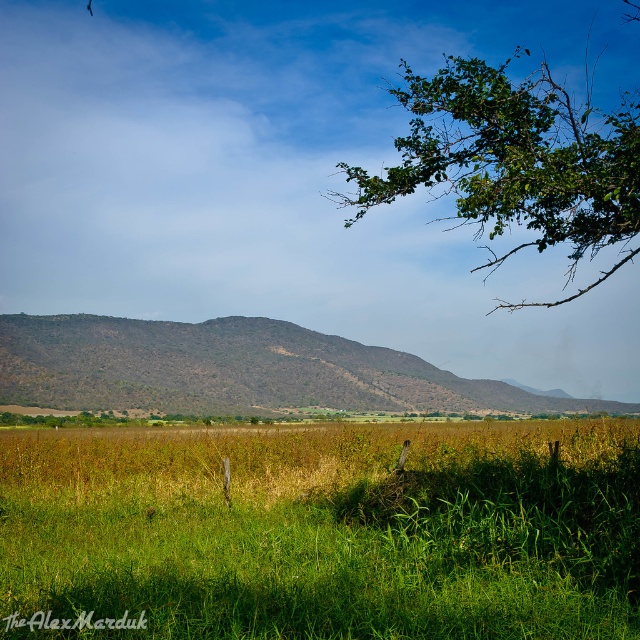
You are standing at the point marked by coordinates point (321, 531) in the image. Based on the scene description, what type of terrain or vegetation would you expect to find there?

The point (321, 531) indicates green grassy at center, so you would expect to find green grassy terrain there.